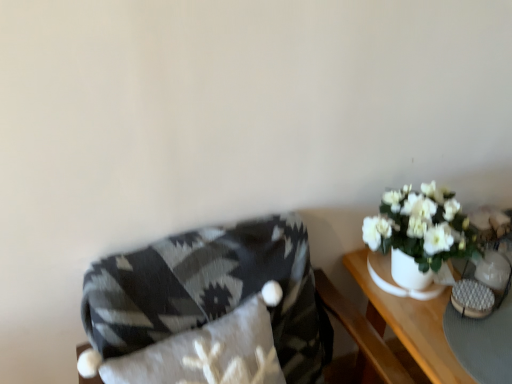
Question: Can you confirm if textured gray blanket at left is wider than white ceramic vase at right?

Choices:
 (A) yes
 (B) no

Answer: (A)

Question: Would you say textured gray blanket at left is outside white ceramic vase at right?

Choices:
 (A) no
 (B) yes

Answer: (B)

Question: Is textured gray blanket at left shorter than white ceramic vase at right?

Choices:
 (A) yes
 (B) no

Answer: (B)

Question: Is textured gray blanket at left facing away from white ceramic vase at right?

Choices:
 (A) yes
 (B) no

Answer: (B)

Question: Does textured gray blanket at left have a greater height compared to white ceramic vase at right?

Choices:
 (A) yes
 (B) no

Answer: (A)

Question: Is textured gray blanket at left aimed at white ceramic vase at right?

Choices:
 (A) yes
 (B) no

Answer: (B)

Question: Does white ceramic vase at right have a smaller size compared to textured gray blanket at left?

Choices:
 (A) yes
 (B) no

Answer: (A)

Question: Is textured gray blanket at left at the back of white ceramic vase at right?

Choices:
 (A) yes
 (B) no

Answer: (B)

Question: From the image's perspective, would you say white ceramic vase at right is shown under textured gray blanket at left?

Choices:
 (A) no
 (B) yes

Answer: (A)

Question: Considering the relative sizes of white ceramic vase at right and textured gray blanket at left in the image provided, is white ceramic vase at right bigger than textured gray blanket at left?

Choices:
 (A) no
 (B) yes

Answer: (A)

Question: Can we say white ceramic vase at right lies outside textured gray blanket at left?

Choices:
 (A) yes
 (B) no

Answer: (A)

Question: Is white ceramic vase at right in contact with textured gray blanket at left?

Choices:
 (A) no
 (B) yes

Answer: (A)

Question: Is textured gray blanket at left positioned in front of white ceramic table at right?

Choices:
 (A) yes
 (B) no

Answer: (A)